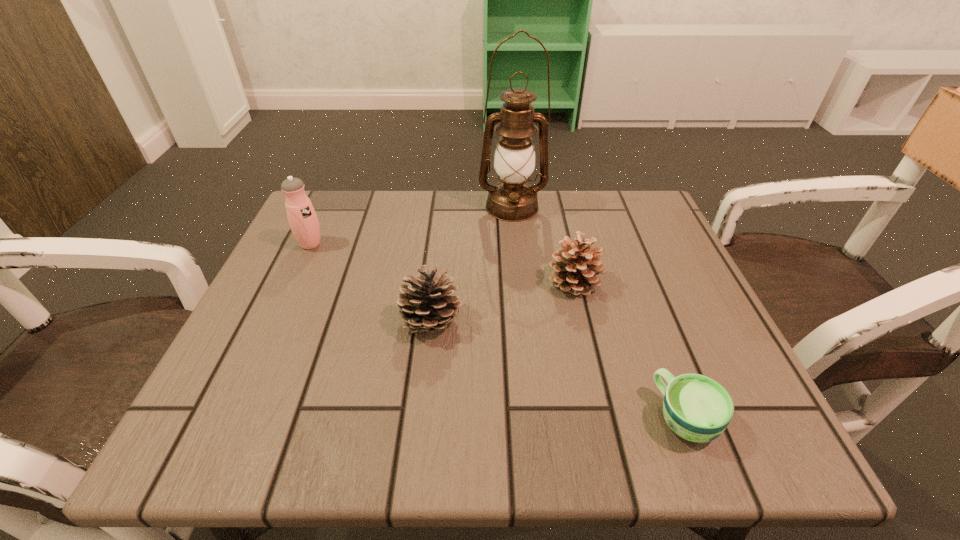
Find the location of a particular element. Image resolution: width=960 pixels, height=540 pixels. free space between the second farthest object and the shortest object is located at coordinates (497, 331).

Locate an element on the screen. unoccupied position between the second object from left to right and the shortest object is located at coordinates (558, 370).

This screenshot has width=960, height=540. I want to click on vacant space that's between the second object from left to right and the cup, so click(x=558, y=370).

The height and width of the screenshot is (540, 960). I want to click on empty space that is in between the oil lamp and the right pinecone, so click(x=543, y=245).

Locate an element on the screen. The image size is (960, 540). free space between the right pinecone and the nearest object is located at coordinates (630, 350).

I want to click on free space between the nearest object and the leftmost object, so click(497, 331).

Identify the location of vacant space that's between the farthest object and the shortest object. This screenshot has height=540, width=960. (598, 312).

Identify the location of vacant space that's between the left pinecone and the right pinecone. The width and height of the screenshot is (960, 540). (503, 302).

Locate which object is the second closest to the shortest object. Please provide its 2D coordinates. Your answer should be formatted as a tuple, i.e. [(x, y)], where the tuple contains the x and y coordinates of a point satisfying the conditions above.

[(428, 305)]

At what (x,y) coordinates should I click in order to perform the action: click on object that stands as the fourth closest to the fourth shortest object. Please return your answer as a coordinate pair (x, y). The height and width of the screenshot is (540, 960). Looking at the image, I should click on (697, 408).